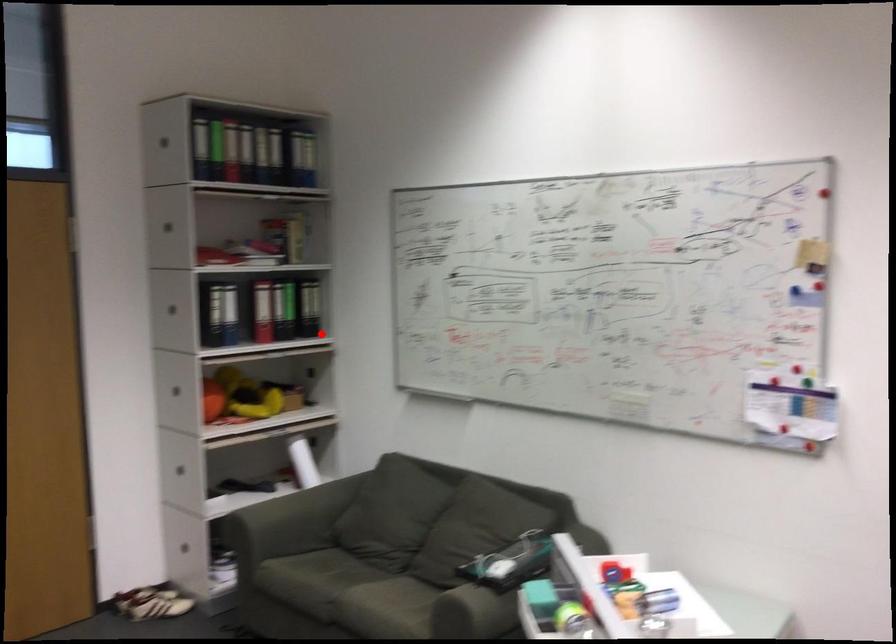
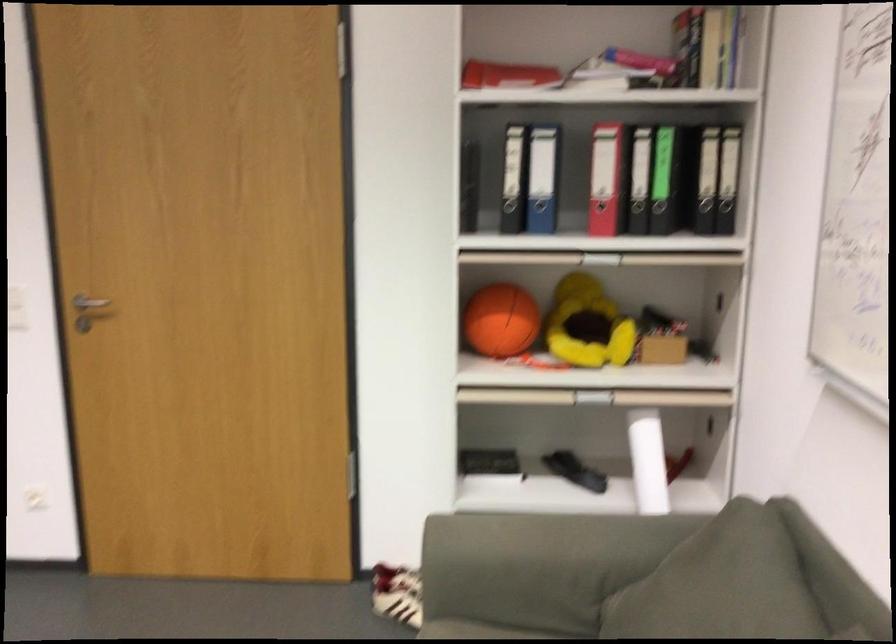
Find the pixel in the second image that matches the highlighted location in the first image.

(734, 214)